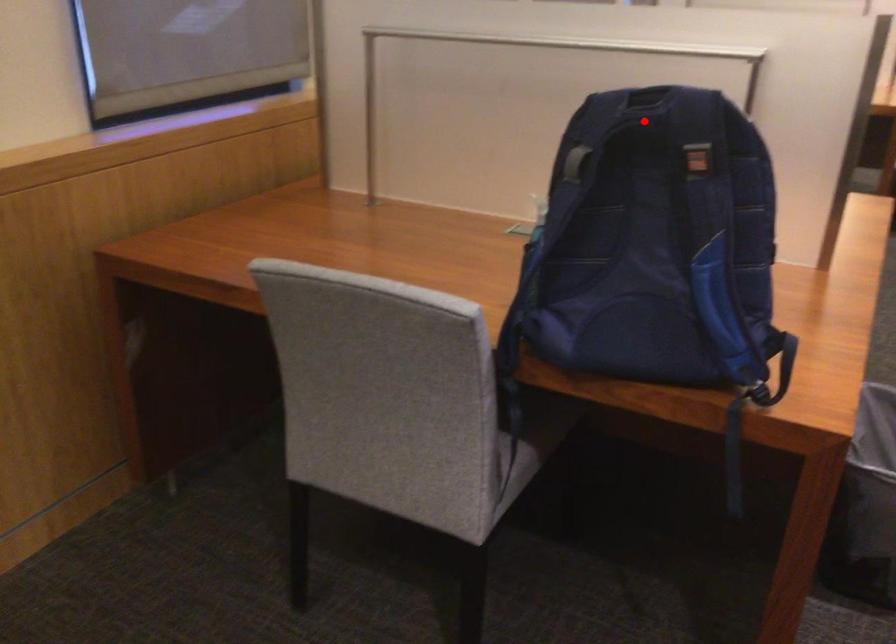
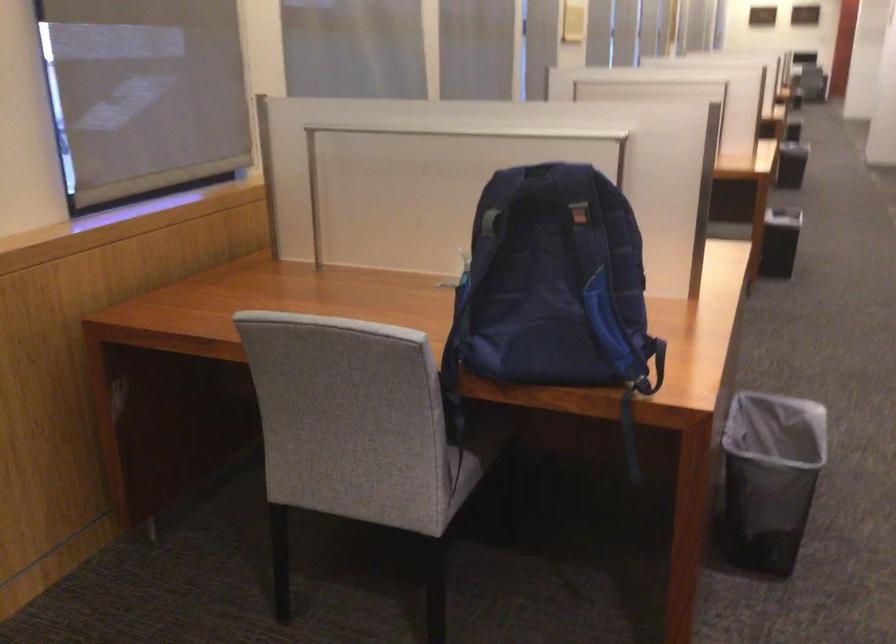
Locate, in the second image, the point that corresponds to the highlighted location in the first image.

(538, 184)